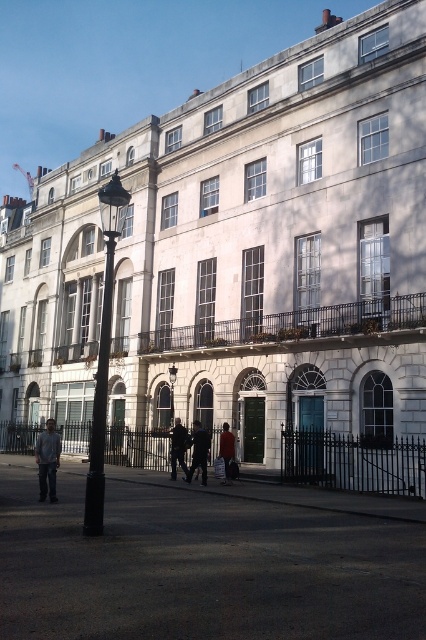
You are standing in front of the classical building and see both the dark gray suit at center and the dark gray jacket at center. Which one is positioned more to the right side?

The dark gray suit at center is positioned more to the right side than the dark gray jacket at center.

You are standing in front of the classical building and see a dark gray jacket at center and a red fabric bag at center. Which object is taller?

The dark gray jacket at center is taller than the red fabric bag at center.

From the picture: You are standing in front of the classical building and want to walk from the lamppost to the fence. Which point, point (186, 472) or point (224, 440), is closer to your starting position at the lamppost?

Point (224, 440) is closer to the lamppost because it is in front of point (186, 472), which is behind it.